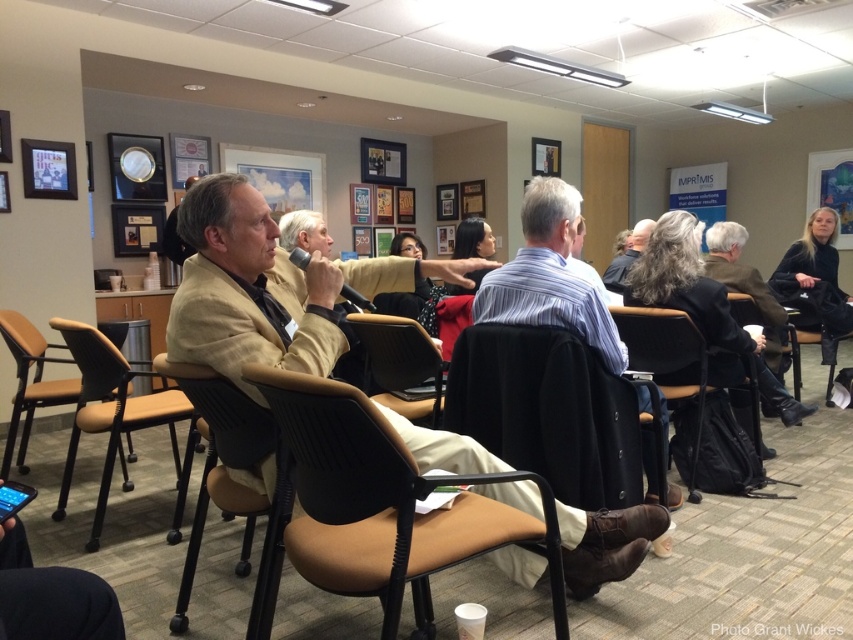
Who is more forward, (111, 349) or (372, 339)?

Point (111, 349)

Does point (146, 426) lie behind point (364, 387)?

No, (146, 426) is closer to viewer.

Does point (80, 397) lie behind point (436, 422)?

Yes, point (80, 397) is behind point (436, 422).

The image size is (853, 640). Find the location of `tan leather chair at left`. tan leather chair at left is located at coordinates (109, 408).

Where is `striped cotton shirt at center`? striped cotton shirt at center is located at coordinates (550, 276).

Who is more forward, (572, 324) or (796, 390)?

Point (572, 324) is more forward.

I want to click on striped cotton shirt at center, so click(x=550, y=276).

Does brown leather chair at left appear on the left side of black leather chair at lower right?

Correct, you'll find brown leather chair at left to the left of black leather chair at lower right.

Can you confirm if brown leather chair at left is positioned to the right of black leather chair at lower right?

Incorrect, brown leather chair at left is not on the right side of black leather chair at lower right.

Who is more distant from viewer, (24, 448) or (737, 305)?

Point (737, 305)

Find the location of a particular element. The height and width of the screenshot is (640, 853). brown leather chair at left is located at coordinates (32, 381).